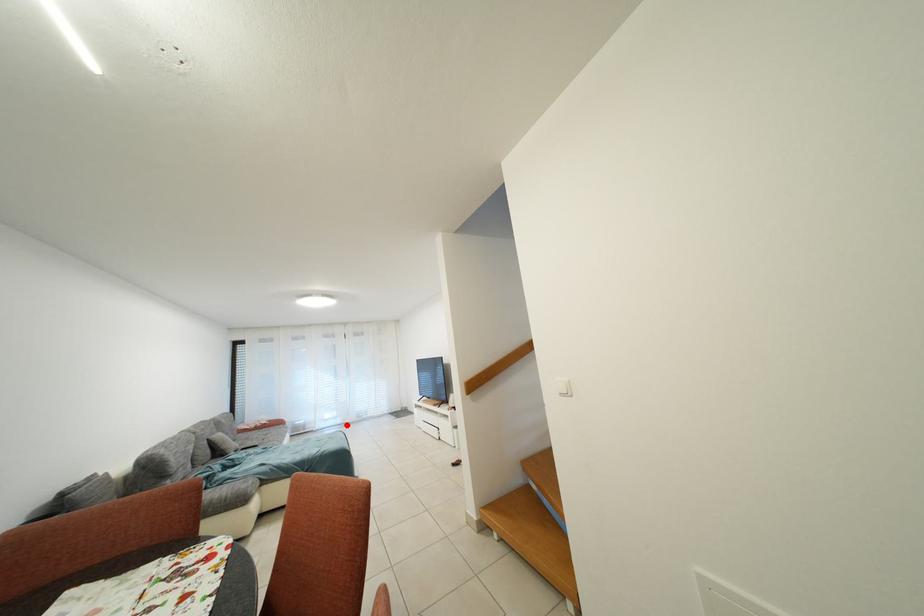
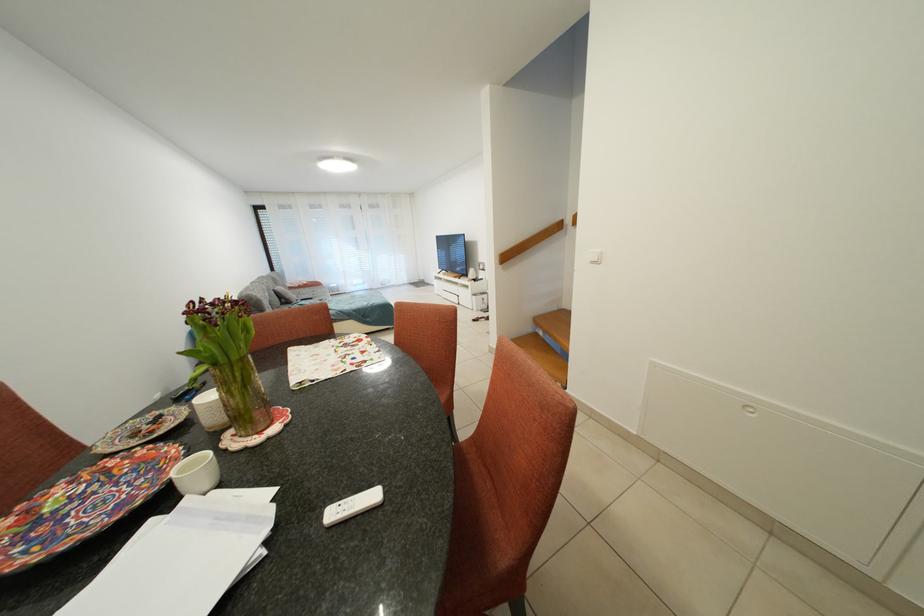
Question: I am providing you with two images of the same scene from different viewpoints. Given a red point in image1, look at the same physical point in image2. Is it:

Choices:
 (A) Closer to the viewpoint
 (B) Farther from the viewpoint

Answer: (A)